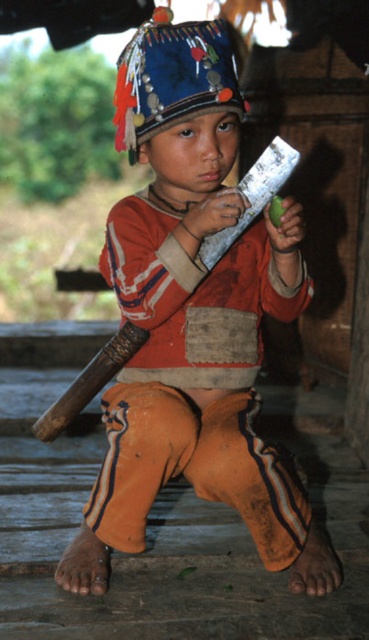
You are a coach observing a baseball practice. You notice two bats in the image. Which bat is taller, the brown wood baseball bat at lower left or the silver metallic baseball bat at center?

The brown wood baseball bat at lower left is taller than the silver metallic baseball bat at center according to the description.

You are a tailor who needs to determine which item is bigger between the orange cotton pants at lower center and the silver metallic baseball bat at center. Which one should you choose?

Answer: The orange cotton pants at lower center has a larger size compared to the silver metallic baseball bat at center, so you should choose the orange cotton pants at lower center.

You are a baseball coach assessing equipment. You have two bats in front of you, the brown wood baseball bat at lower left and the silver metallic baseball bat at center. Which bat has a larger diameter?

The brown wood baseball bat at lower left might be wider than silver metallic baseball bat at center according to the description.